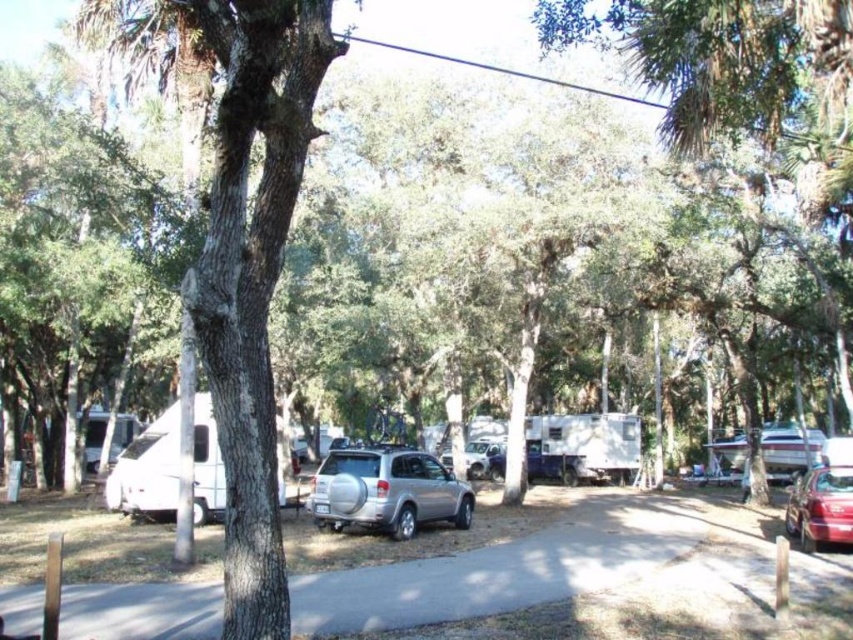
Who is more forward, (361, 497) or (796, 534)?

Point (361, 497) is more forward.

Describe the element at coordinates (387, 492) in the screenshot. This screenshot has height=640, width=853. I see `silver metallic suv at center` at that location.

Does point (355, 518) come in front of point (846, 532)?

No, it is not.

Identify the location of silver metallic suv at center. The image size is (853, 640). (387, 492).

Does smooth bark tree at left have a lesser height compared to shiny red sedan at lower right?

Indeed, smooth bark tree at left has a lesser height compared to shiny red sedan at lower right.

Identify the location of smooth bark tree at left. The width and height of the screenshot is (853, 640). (244, 253).

I want to click on smooth bark tree at left, so click(244, 253).

Can you confirm if white matte camper at left is smaller than satin silver suv at center?

Incorrect, white matte camper at left is not smaller in size than satin silver suv at center.

Does white matte camper at left come behind satin silver suv at center?

No, it is in front of satin silver suv at center.

Which is in front, point (166, 461) or point (473, 465)?

Point (166, 461) is more forward.

Where is `white matte camper at left`? This screenshot has height=640, width=853. white matte camper at left is located at coordinates (148, 468).